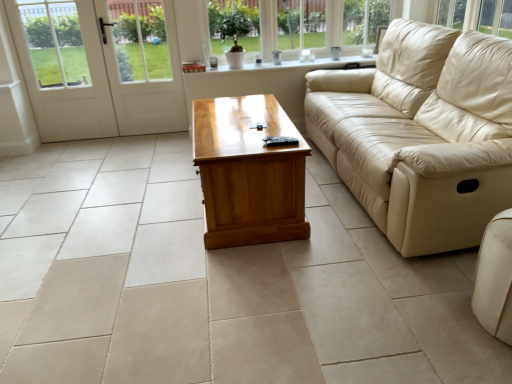
The height and width of the screenshot is (384, 512). Find the location of `unoccupied space behind beige leather couch at lower right, the 1th studio couch in the bottom-to-top sequence`. unoccupied space behind beige leather couch at lower right, the 1th studio couch in the bottom-to-top sequence is located at coordinates (442, 277).